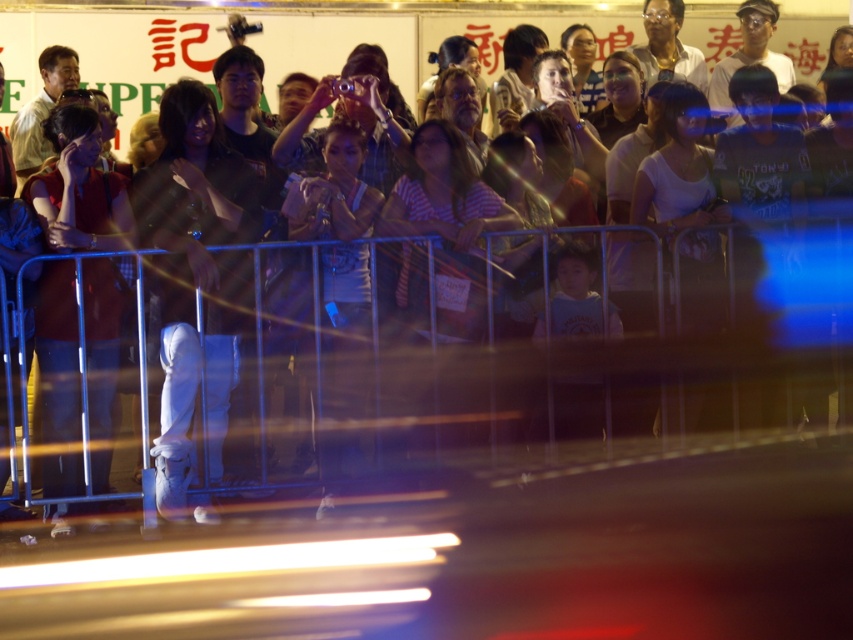
Question: Which object appears closest to the camera in this image?

Choices:
 (A) matte red shirt at center
 (B) white leather boots at center

Answer: (B)

Question: Which of the following is the farthest from the observer?

Choices:
 (A) matte red shirt at center
 (B) white leather boots at center

Answer: (A)

Question: Does white leather boots at center have a greater width compared to matte red shirt at center?

Choices:
 (A) no
 (B) yes

Answer: (B)

Question: Can you confirm if white leather boots at center is positioned to the right of matte red shirt at center?

Choices:
 (A) yes
 (B) no

Answer: (A)

Question: Is white leather boots at center smaller than matte red shirt at center?

Choices:
 (A) yes
 (B) no

Answer: (B)